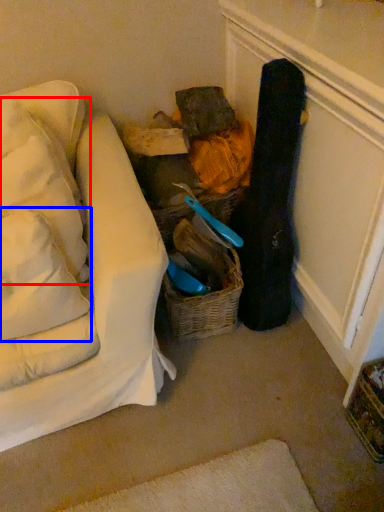
Question: Which point is further to the camera, pillow (highlighted by a red box) or pillow (highlighted by a blue box)?

Choices:
 (A) pillow
 (B) pillow

Answer: (A)